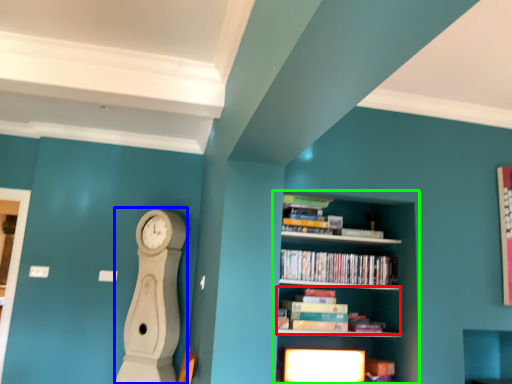
Question: Based on their relative distances, which object is nearer to book (highlighted by a red box)? Choose from clock (highlighted by a blue box) and shelf (highlighted by a green box).

Choices:
 (A) clock
 (B) shelf

Answer: (B)